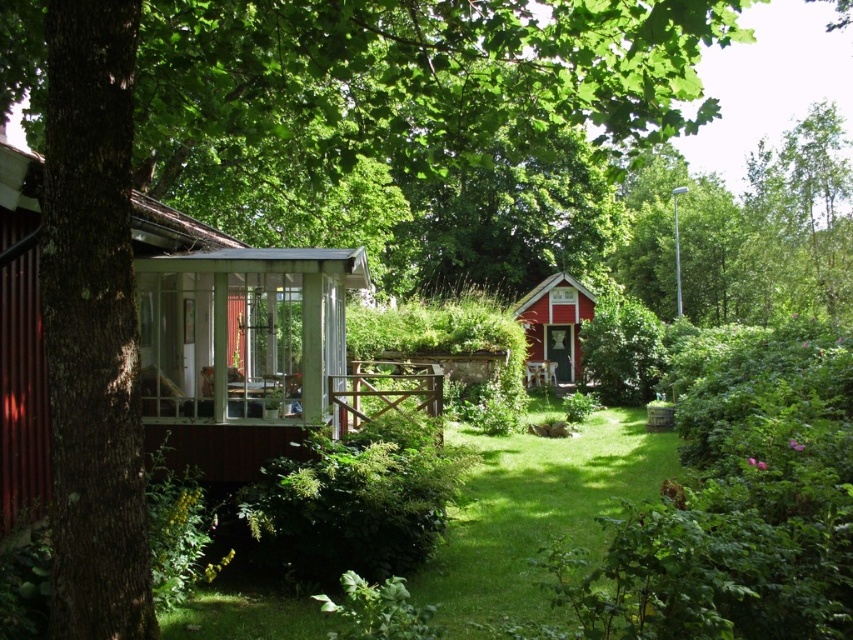
You are a gardener standing in the garden and want to water the green grass at center. However, you need to avoid stepping on the matte red wooden cottage at center. Which direction should you move to reach the grass without stepping on the cottage?

The green grass at center is in front of the matte red wooden cottage at center, so you should move forward towards the grass to water it without stepping on the cottage.